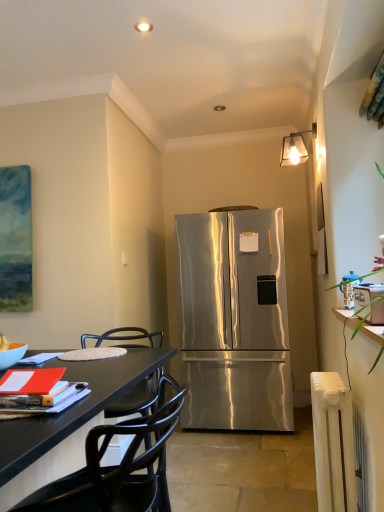
Where is `black matte chair at lower left`? The height and width of the screenshot is (512, 384). black matte chair at lower left is located at coordinates (112, 469).

What do you see at coordinates (333, 443) in the screenshot? The height and width of the screenshot is (512, 384). I see `white plastic radiator at lower right` at bounding box center [333, 443].

You are a GUI agent. You are given a task and a screenshot of the screen. Output one action in this format:
    pyautogui.click(x=<x>, y=<y>)
    Task: Click on the matte orange book at lower left
    Image resolution: width=384 pixels, height=512 pixels.
    Given the screenshot: What is the action you would take?
    pyautogui.click(x=45, y=399)

I want to click on clear glass lampshade at upper center, so click(296, 147).

Is white plastic radiator at lower right bigger or smaller than stainless steel refrigerator at center?

In the image, white plastic radiator at lower right appears to be smaller than stainless steel refrigerator at center.

Measure the distance between white plastic radiator at lower right and stainless steel refrigerator at center.

They are 5.23 feet apart.

Between white plastic radiator at lower right and stainless steel refrigerator at center, which one has less height?

white plastic radiator at lower right.

Is point (326, 388) closer to viewer compared to point (268, 228)?

Yes.

From the image's perspective, which is above, white plastic radiator at lower right or black matte chair at lower left?

black matte chair at lower left appears higher in the image.

Looking at this image, in terms of size, does white plastic radiator at lower right appear bigger or smaller than black matte chair at lower left?

white plastic radiator at lower right is smaller than black matte chair at lower left.

Which is more to the left, white plastic radiator at lower right or black matte chair at lower left?

Positioned to the left is black matte chair at lower left.

Is white plastic radiator at lower right in front of or behind black matte chair at lower left in the image?

Visually, white plastic radiator at lower right is located behind black matte chair at lower left.

Considering the positions of objects clear glass lampshade at upper center and black matte chair at lower left in the image provided, who is more to the right, clear glass lampshade at upper center or black matte chair at lower left?

clear glass lampshade at upper center.

Is there a large distance between clear glass lampshade at upper center and black matte chair at lower left?

Yes, clear glass lampshade at upper center is far from black matte chair at lower left.

From a real-world perspective, which is physically above, clear glass lampshade at upper center or black matte chair at lower left?

In real-world perspective, clear glass lampshade at upper center is above.

Can you confirm if clear glass lampshade at upper center is wider than black matte chair at lower left?

Incorrect, the width of clear glass lampshade at upper center does not surpass that of black matte chair at lower left.

I want to click on chair located underneath the clear glass lampshade at upper center (from a real-world perspective), so click(112, 469).

From a real-world perspective, who is located higher, black matte chair at lower left or clear glass lampshade at upper center?

From a 3D spatial view, clear glass lampshade at upper center is above.

Can we say black matte chair at lower left lies outside clear glass lampshade at upper center?

Yes, black matte chair at lower left is not within clear glass lampshade at upper center.

Is there a large distance between black matte chair at lower left and clear glass lampshade at upper center?

That's right, there is a large distance between black matte chair at lower left and clear glass lampshade at upper center.

Image resolution: width=384 pixels, height=512 pixels. I want to click on book that appears below the clear glass lampshade at upper center (from the image's perspective), so click(x=45, y=399).

Considering the relative positions of clear glass lampshade at upper center and matte orange book at lower left in the image provided, is clear glass lampshade at upper center to the left of matte orange book at lower left from the viewer's perspective?

Incorrect, clear glass lampshade at upper center is not on the left side of matte orange book at lower left.

How far apart are clear glass lampshade at upper center and matte orange book at lower left?

The distance of clear glass lampshade at upper center from matte orange book at lower left is 2.34 meters.

Is clear glass lampshade at upper center oriented away from matte orange book at lower left?

No, clear glass lampshade at upper center's orientation is not away from matte orange book at lower left.

In the image, is black matte chair at lower left on the left side or the right side of stainless steel refrigerator at center?

From the image, it's evident that black matte chair at lower left is to the left of stainless steel refrigerator at center.

Is black matte chair at lower left aimed at stainless steel refrigerator at center?

No, black matte chair at lower left is not oriented towards stainless steel refrigerator at center.

Is black matte chair at lower left surrounding stainless steel refrigerator at center?

No.

Between black matte chair at lower left and stainless steel refrigerator at center, which one is positioned in front?

black matte chair at lower left is closer to the camera.

Find the location of a particular element. lamp located above the stainless steel refrigerator at center (from a real-world perspective) is located at coordinates (296, 147).

Based on their positions, is clear glass lampshade at upper center located to the left or right of stainless steel refrigerator at center?

In the image, clear glass lampshade at upper center appears on the right side of stainless steel refrigerator at center.

From a real-world perspective, is clear glass lampshade at upper center positioned over stainless steel refrigerator at center based on gravity?

Correct, in the physical world, clear glass lampshade at upper center is higher than stainless steel refrigerator at center.

Are clear glass lampshade at upper center and stainless steel refrigerator at center located far from each other?

Indeed, clear glass lampshade at upper center is not near stainless steel refrigerator at center.

Identify the location of refrigerator that appears behind the white plastic radiator at lower right. (234, 321).

You are a GUI agent. You are given a task and a screenshot of the screen. Output one action in this format:
    pyautogui.click(x=<x>, y=<y>)
    Task: Click on the radiator below the black matte chair at lower left (from the image's perspective)
    
    Given the screenshot: What is the action you would take?
    pyautogui.click(x=333, y=443)

Considering their positions, is matte orange book at lower left positioned closer to black matte chair at lower left than clear glass lampshade at upper center?

The object closer to black matte chair at lower left is matte orange book at lower left.

Looking at the image, which one is located closer to stainless steel refrigerator at center, black matte chair at lower left or clear glass lampshade at upper center?

clear glass lampshade at upper center lies closer to stainless steel refrigerator at center than the other object.

From the image, which object appears to be farther from white plastic radiator at lower right, stainless steel refrigerator at center or matte orange book at lower left?

The object further to white plastic radiator at lower right is stainless steel refrigerator at center.

From the image, which object appears to be nearer to stainless steel refrigerator at center, black matte chair at lower left or white plastic radiator at lower right?

Among the two, white plastic radiator at lower right is located nearer to stainless steel refrigerator at center.

Estimate the real-world distances between objects in this image. Which object is closer to clear glass lampshade at upper center, white plastic radiator at lower right or stainless steel refrigerator at center?

The object closer to clear glass lampshade at upper center is stainless steel refrigerator at center.

Looking at the image, which one is located further to stainless steel refrigerator at center, matte orange book at lower left or white plastic radiator at lower right?

Among the two, matte orange book at lower left is located further to stainless steel refrigerator at center.

When comparing their distances from stainless steel refrigerator at center, does clear glass lampshade at upper center or matte orange book at lower left seem closer?

clear glass lampshade at upper center is positioned closer to the anchor stainless steel refrigerator at center.

From the image, which object appears to be nearer to matte orange book at lower left, white plastic radiator at lower right or stainless steel refrigerator at center?

white plastic radiator at lower right is closer to matte orange book at lower left.

Where is `lamp between matte orange book at lower left and stainless steel refrigerator at center from front to back`? lamp between matte orange book at lower left and stainless steel refrigerator at center from front to back is located at coordinates (296, 147).

This screenshot has height=512, width=384. What are the coordinates of `refrigerator between clear glass lampshade at upper center and white plastic radiator at lower right from top to bottom` in the screenshot? It's located at (234, 321).

The height and width of the screenshot is (512, 384). In order to click on chair situated between matte orange book at lower left and white plastic radiator at lower right from left to right in this screenshot , I will do `click(112, 469)`.

At what (x,y) coordinates should I click in order to perform the action: click on book between black matte chair at lower left and clear glass lampshade at upper center from front to back. Please return your answer as a coordinate pair (x, y). The image size is (384, 512). Looking at the image, I should click on (45, 399).